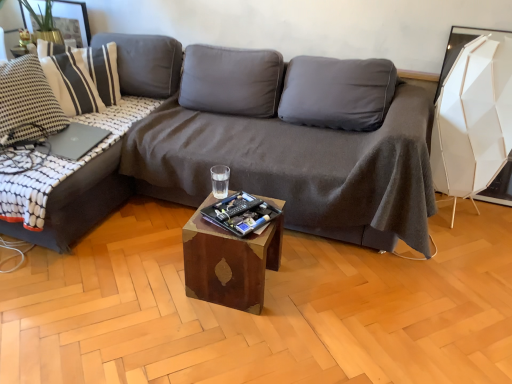
This screenshot has height=384, width=512. What are the coordinates of `free point above slate gray matte laptop at left (from a real-world perspective)` in the screenshot? It's located at coord(70,133).